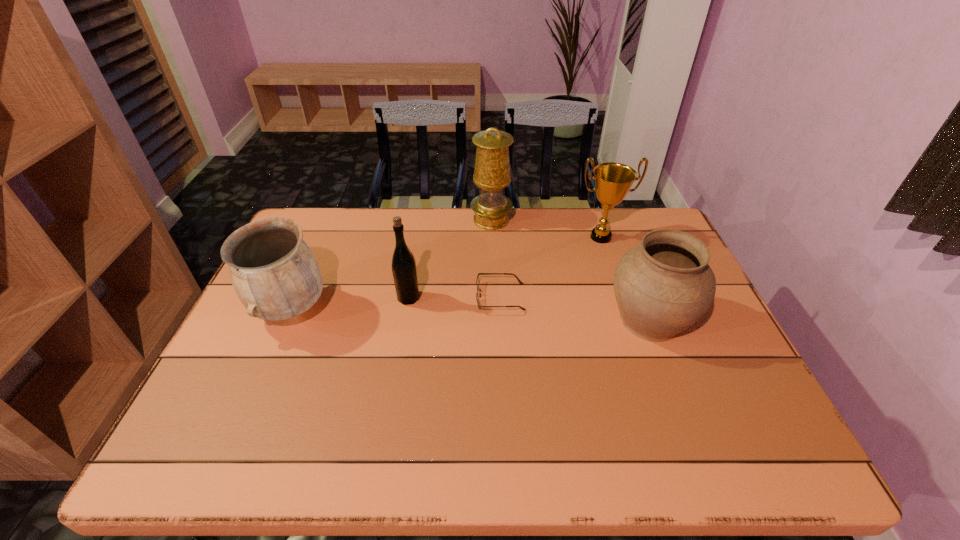
At what (x,y) coordinates should I click in order to perform the action: click on blank space at the far edge. Please return your answer as a coordinate pair (x, y). Image resolution: width=960 pixels, height=540 pixels. Looking at the image, I should click on (581, 229).

Find the location of `vacant space at the near edge`. vacant space at the near edge is located at coordinates (370, 427).

The width and height of the screenshot is (960, 540). Identify the location of free space at the left edge. (322, 265).

Locate an element on the screen. Image resolution: width=960 pixels, height=540 pixels. free space at the far left corner is located at coordinates (344, 215).

Identify the location of free spot between the oil lamp and the left urn. The width and height of the screenshot is (960, 540). (392, 265).

You are a GUI agent. You are given a task and a screenshot of the screen. Output one action in this format:
    pyautogui.click(x=<x>, y=<y>)
    Task: Click on the free space between the right urn and the leftmost object
    This screenshot has width=960, height=540.
    Given the screenshot: What is the action you would take?
    pyautogui.click(x=470, y=314)

This screenshot has height=540, width=960. Identify the location of free space between the oil lamp and the leftmost object. (392, 265).

Locate an element on the screen. This screenshot has height=540, width=960. blank region between the award and the shortest object is located at coordinates (551, 267).

This screenshot has height=540, width=960. Identify the location of free space between the shortest object and the award. (551, 267).

The image size is (960, 540). What are the coordinates of `free point between the oil lamp and the right urn` in the screenshot? It's located at (570, 270).